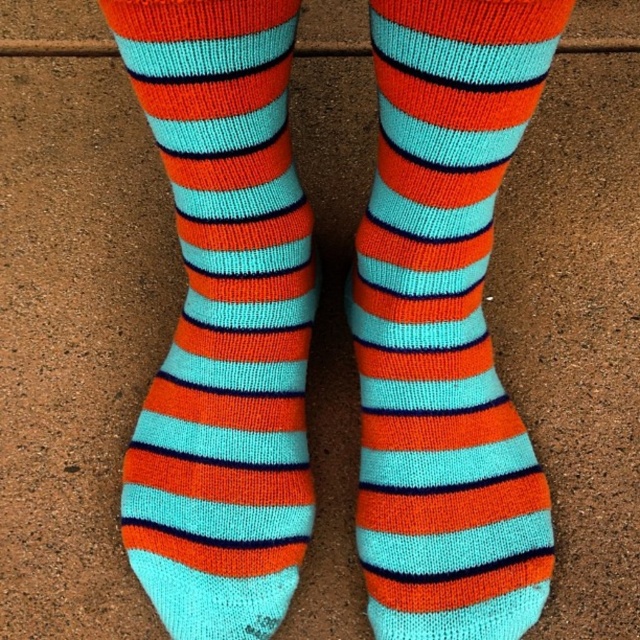
Question: Is knitted cotton sock at center thinner than knit socks at center?

Choices:
 (A) no
 (B) yes

Answer: (A)

Question: Which of the following is the farthest from the observer?

Choices:
 (A) knitted cotton sock at center
 (B) knit socks at center

Answer: (B)

Question: Among these objects, which one is farthest from the camera?

Choices:
 (A) knit socks at center
 (B) knitted cotton sock at center

Answer: (A)

Question: Is knitted cotton sock at center to the left of knit socks at center from the viewer's perspective?

Choices:
 (A) no
 (B) yes

Answer: (A)

Question: Does knitted cotton sock at center come in front of knit socks at center?

Choices:
 (A) no
 (B) yes

Answer: (B)

Question: Among these objects, which one is farthest from the camera?

Choices:
 (A) knit socks at center
 (B) knitted cotton sock at center

Answer: (A)